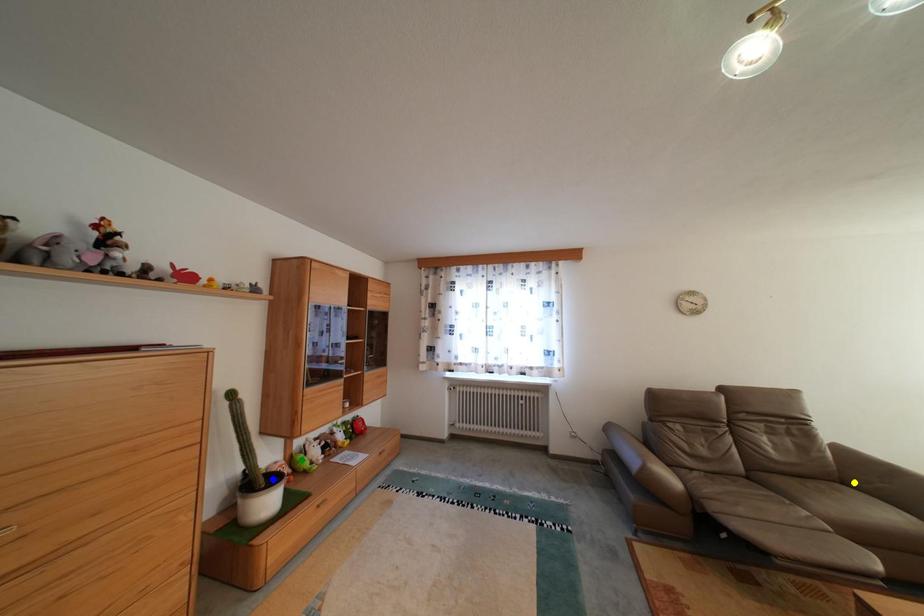
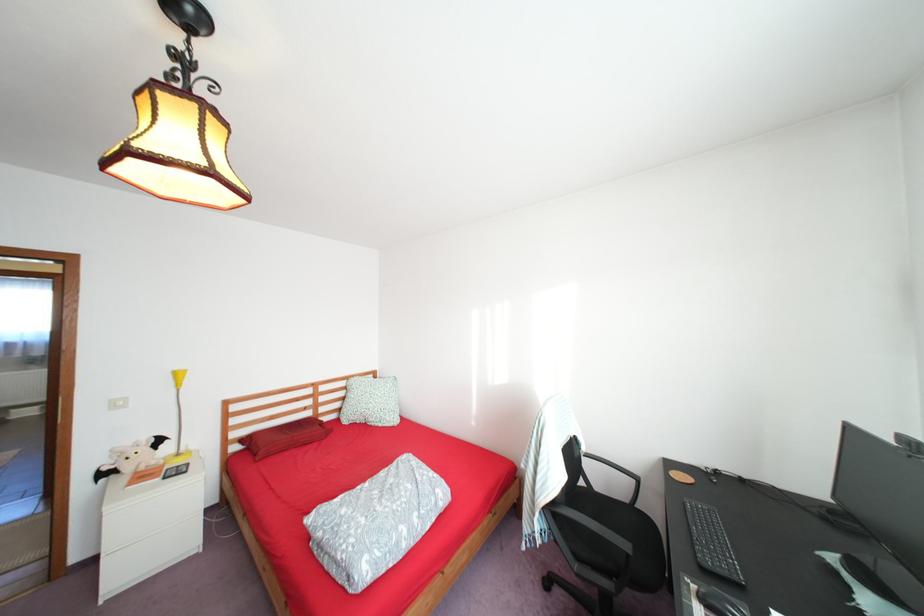
I am providing you with two images of the same scene from different viewpoints. Three points are marked in image1. Which point corresponds to a part or object that is occluded in image2?In image1, three points are marked. Which of them correspond to a part or object that is occluded in image2?Among the three points shown in image1, which one corresponds to a part or object that is no longer visible due to occlusion in image2?

yellow point, blue point, green point cannot be seen in image2.